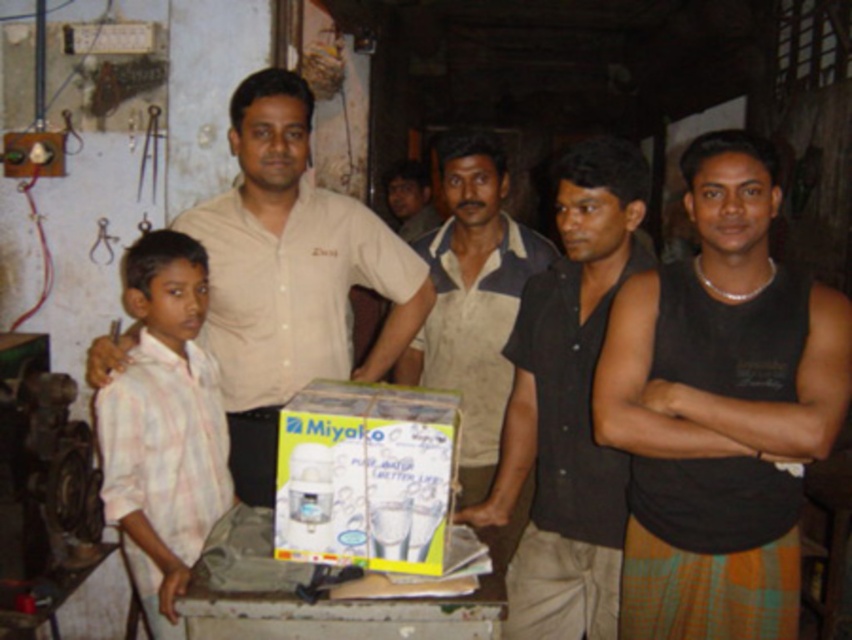
Does point (228, 352) come farther from viewer compared to point (565, 444)?

Yes, it is behind point (565, 444).

Can you confirm if matte beige shirt at center is positioned to the right of black matte shirt at center?

No, matte beige shirt at center is not to the right of black matte shirt at center.

Between point (321, 342) and point (532, 444), which one is positioned in front?

Point (532, 444)

The image size is (852, 640). Identify the location of matte beige shirt at center. point(291,275).

Is matte beige shirt at center behind pink striped shirt at left?

Yes, matte beige shirt at center is behind pink striped shirt at left.

The height and width of the screenshot is (640, 852). What do you see at coordinates (291, 275) in the screenshot?
I see `matte beige shirt at center` at bounding box center [291, 275].

The height and width of the screenshot is (640, 852). I want to click on matte beige shirt at center, so click(291, 275).

Who is positioned more to the left, matte beige shirt at center or white plastic miyako water purifier at center?

matte beige shirt at center

Who is taller, matte beige shirt at center or white plastic miyako water purifier at center?

With more height is matte beige shirt at center.

Does point (301, 212) come behind point (423, 424)?

Yes, it is.

Where is `matte beige shirt at center`? matte beige shirt at center is located at coordinates (x=291, y=275).